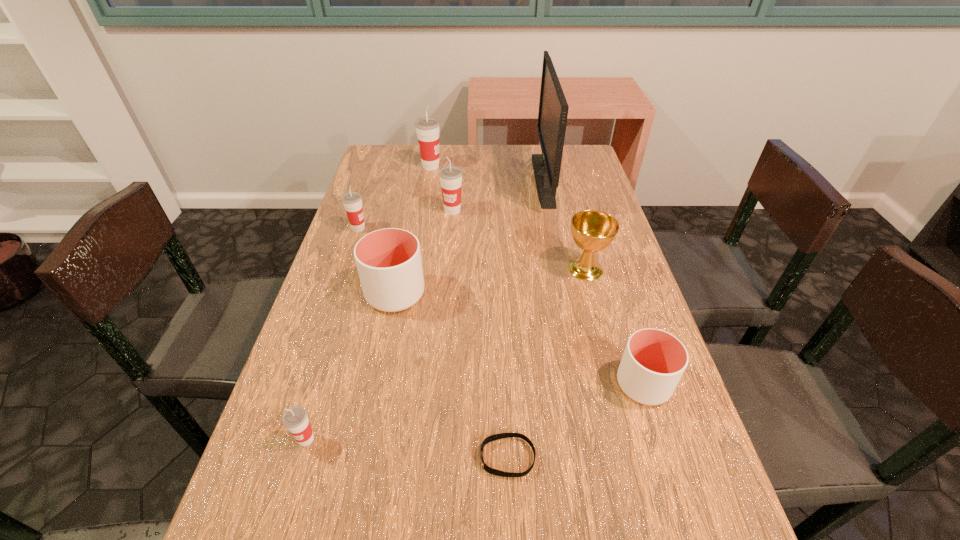
Image resolution: width=960 pixels, height=540 pixels. In order to click on vacant space that's between the third farthest cup and the smallest red cup in this screenshot , I will do `click(332, 334)`.

Locate an element on the screen. unoccupied area between the left white cup and the tallest cup is located at coordinates (413, 230).

You are a GUI agent. You are given a task and a screenshot of the screen. Output one action in this format:
    pyautogui.click(x=<x>, y=<y>)
    Task: Click on the free space between the monitor and the wristband
    This screenshot has height=540, width=960.
    Given the screenshot: What is the action you would take?
    pyautogui.click(x=525, y=318)

Select which object appears as the second closest to the chalice. Please provide its 2D coordinates. Your answer should be formatted as a tuple, i.e. [(x, y)], where the tuple contains the x and y coordinates of a point satisfying the conditions above.

[(653, 362)]

Identify which object is located as the second nearest to the chalice. Please provide its 2D coordinates. Your answer should be formatted as a tuple, i.e. [(x, y)], where the tuple contains the x and y coordinates of a point satisfying the conditions above.

[(653, 362)]

Locate an element on the screen. cup that is the third closest to the right white cup is located at coordinates (450, 176).

Where is `the closest cup relative to the second smallest red cup`? This screenshot has width=960, height=540. the closest cup relative to the second smallest red cup is located at coordinates (389, 264).

At what (x,y) coordinates should I click in order to perform the action: click on the third closest red cup relative to the tallest object. Please return your answer as a coordinate pair (x, y). This screenshot has width=960, height=540. Looking at the image, I should click on (352, 201).

Locate an element on the screen. the closest red cup relative to the second smallest red cup is located at coordinates (450, 176).

Identify the location of free space that satisfies the following two spatial constraints: 1. on the side of the farther white cup with the logo; 2. on the left side of the sixth nearest object. The height and width of the screenshot is (540, 960). (337, 294).